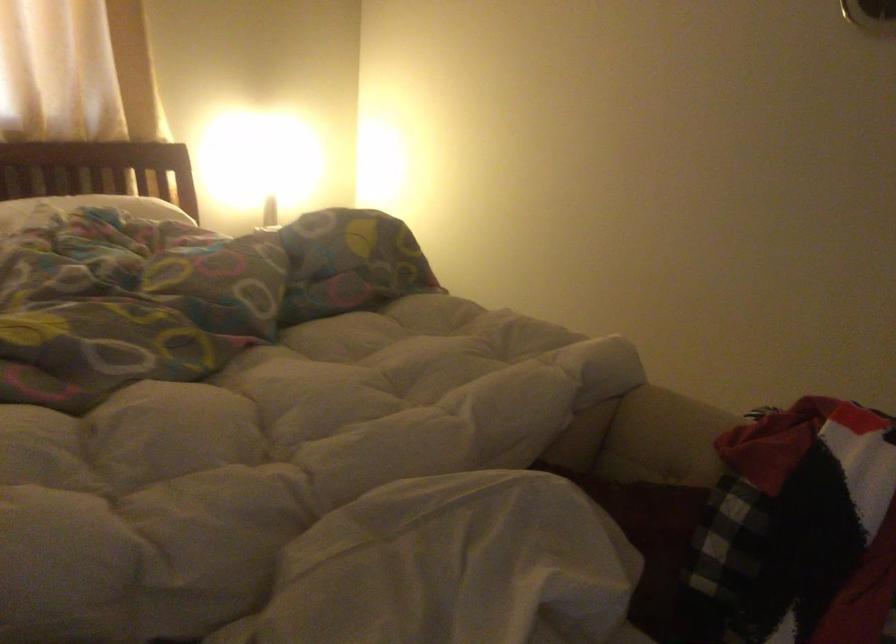
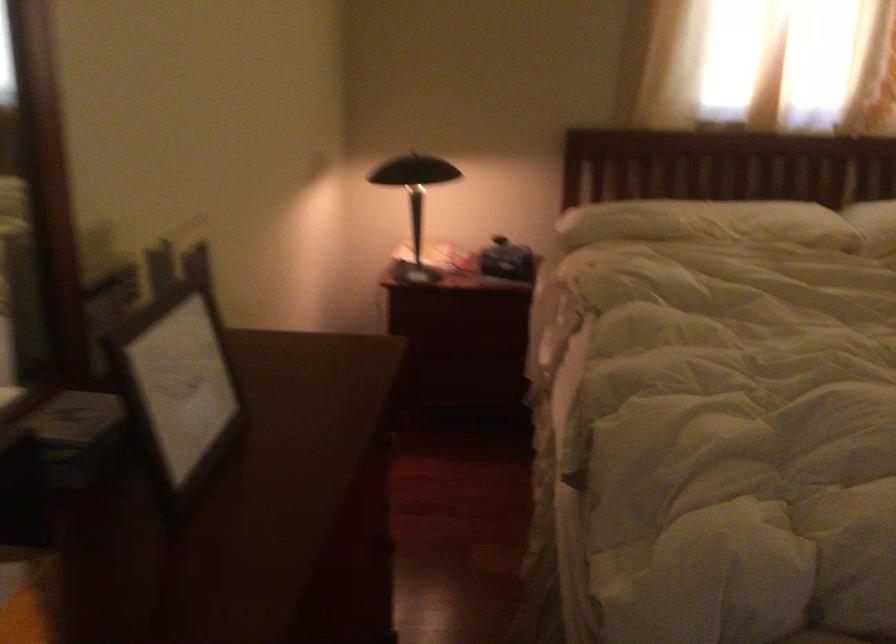
Question: The camera is either moving clockwise (left) or counter-clockwise (right) around the object. The first image is from the beginning of the video and the second image is from the end. Is the camera moving left or right when shooting the video?

Choices:
 (A) Left
 (B) Right

Answer: (B)